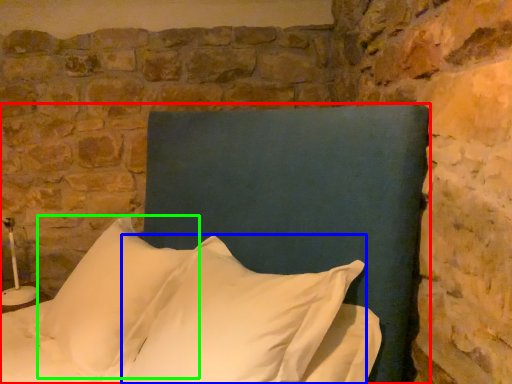
Question: Based on their relative distances, which object is farther from bed (highlighted by a red box)? Choose from pillow (highlighted by a blue box) and pillow (highlighted by a green box).

Choices:
 (A) pillow
 (B) pillow

Answer: (B)